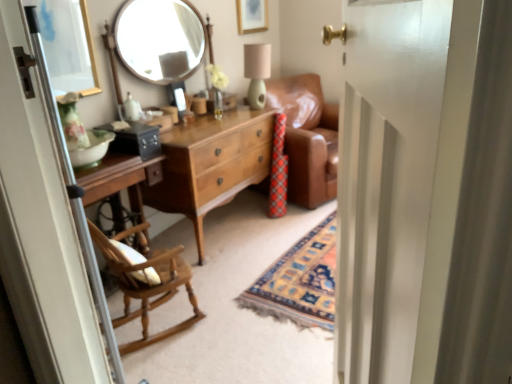
This screenshot has height=384, width=512. In order to click on unoccupied region to the right of matte brown coffee cup at center in this screenshot , I will do `click(224, 112)`.